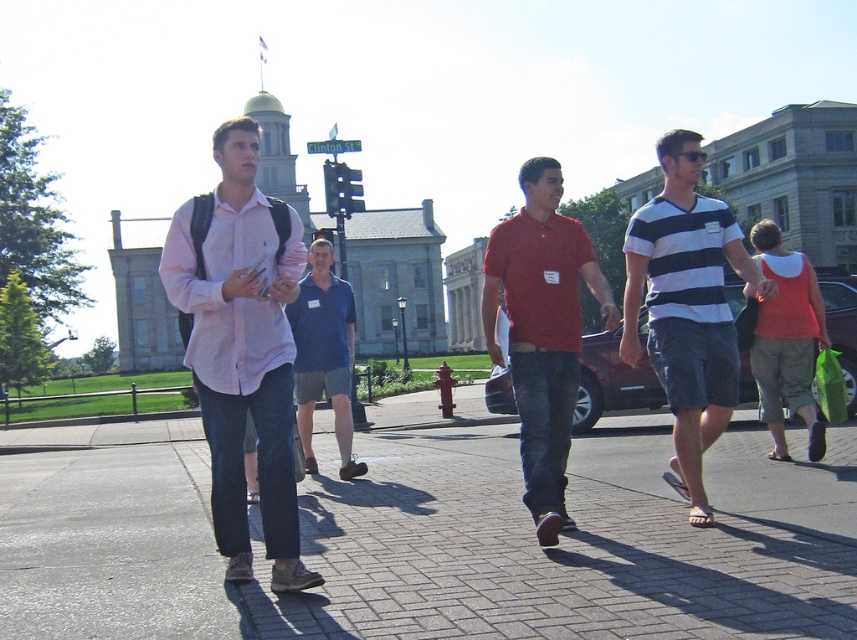
Between pink cotton shirt at center and matte orange tank top at right, which one has less height?

Standing shorter between the two is matte orange tank top at right.

Can you confirm if pink cotton shirt at center is positioned above matte orange tank top at right?

No.

Is point (262, 449) positioned before point (819, 436)?

Yes, point (262, 449) is in front of point (819, 436).

At what (x,y) coordinates should I click in order to perform the action: click on pink cotton shirt at center. Please return your answer as a coordinate pair (x, y). The width and height of the screenshot is (857, 640). Looking at the image, I should click on (243, 349).

Is striped cotton shirt at center in front of matte orange tank top at right?

Yes, it is in front of matte orange tank top at right.

This screenshot has width=857, height=640. I want to click on striped cotton shirt at center, so click(x=687, y=307).

Who is more forward, (x=562, y=612) or (x=568, y=340)?

Positioned in front is point (x=562, y=612).

Does brick pavement at center appear over matte red polo shirt at center?

No.

Between point (267, 576) and point (556, 525), which one is positioned behind?

The point (556, 525) is more distant.

Identify the location of brick pavement at center. (432, 540).